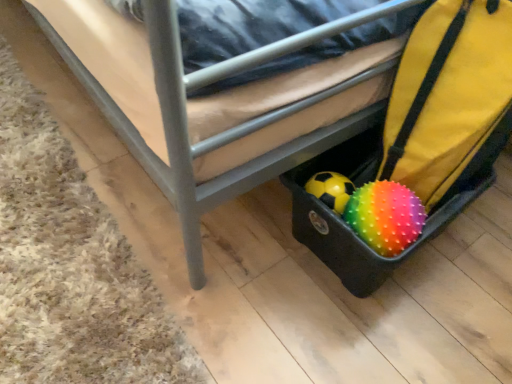
Question: Should I look upward or downward to see brown carpet at lower left?

Choices:
 (A) down
 (B) up

Answer: (B)

Question: From a real-world perspective, does rainbow spiky ball at lower right stand above rubberized black suitcase at lower right?

Choices:
 (A) no
 (B) yes

Answer: (B)

Question: Does rainbow spiky ball at lower right contain rubberized black suitcase at lower right?

Choices:
 (A) no
 (B) yes

Answer: (A)

Question: Does rainbow spiky ball at lower right have a greater width compared to rubberized black suitcase at lower right?

Choices:
 (A) yes
 (B) no

Answer: (B)

Question: Is rainbow spiky ball at lower right bigger than rubberized black suitcase at lower right?

Choices:
 (A) yes
 (B) no

Answer: (B)

Question: Considering the relative sizes of rainbow spiky ball at lower right and rubberized black suitcase at lower right in the image provided, is rainbow spiky ball at lower right smaller than rubberized black suitcase at lower right?

Choices:
 (A) no
 (B) yes

Answer: (B)

Question: Does rainbow spiky ball at lower right appear on the right side of rubberized black suitcase at lower right?

Choices:
 (A) no
 (B) yes

Answer: (A)

Question: Considering the relative sizes of rubberized black suitcase at lower right and brown carpet at lower left in the image provided, is rubberized black suitcase at lower right shorter than brown carpet at lower left?

Choices:
 (A) yes
 (B) no

Answer: (B)

Question: Can you see rubberized black suitcase at lower right touching brown carpet at lower left?

Choices:
 (A) no
 (B) yes

Answer: (A)

Question: From the image's perspective, does rubberized black suitcase at lower right appear higher than brown carpet at lower left?

Choices:
 (A) yes
 (B) no

Answer: (B)

Question: Does rubberized black suitcase at lower right have a smaller size compared to brown carpet at lower left?

Choices:
 (A) no
 (B) yes

Answer: (A)

Question: Is rubberized black suitcase at lower right to the right of brown carpet at lower left from the viewer's perspective?

Choices:
 (A) no
 (B) yes

Answer: (B)

Question: Considering the relative positions of rubberized black suitcase at lower right and brown carpet at lower left in the image provided, is rubberized black suitcase at lower right behind brown carpet at lower left?

Choices:
 (A) yes
 (B) no

Answer: (A)

Question: From the image's perspective, is brown carpet at lower left above rainbow spiky ball at lower right?

Choices:
 (A) yes
 (B) no

Answer: (A)